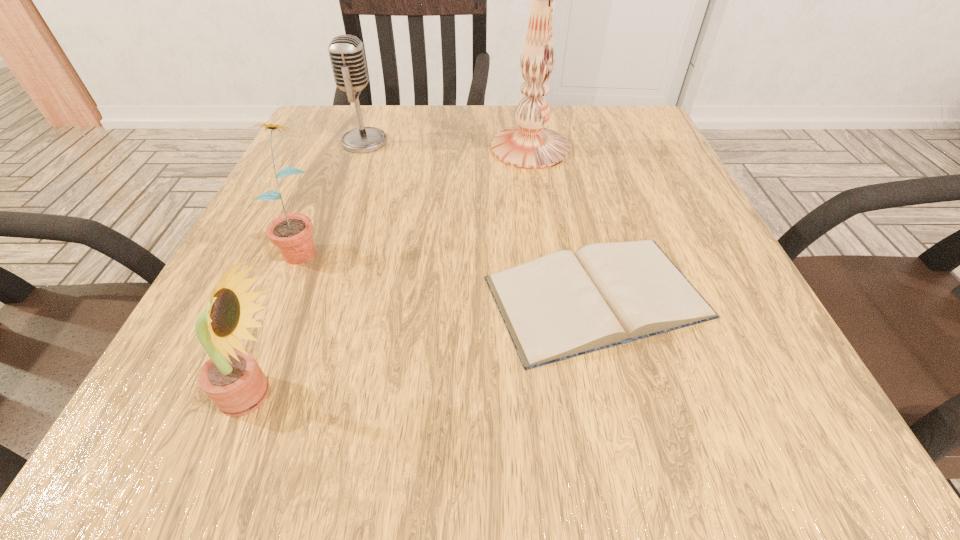
Locate an element on the screen. vacant space that is in between the microphone and the shortest object is located at coordinates (481, 219).

You are a GUI agent. You are given a task and a screenshot of the screen. Output one action in this format:
    pyautogui.click(x=<x>, y=<y>)
    Task: Click on the free spot between the tallest object and the nearer sunflower
    This screenshot has height=540, width=960.
    Given the screenshot: What is the action you would take?
    pyautogui.click(x=393, y=271)

Image resolution: width=960 pixels, height=540 pixels. In order to click on free space between the microphone and the farther sunflower in this screenshot , I will do `click(333, 194)`.

Where is `empty space between the nearer sunflower and the lamp`? empty space between the nearer sunflower and the lamp is located at coordinates (393, 271).

The image size is (960, 540). Find the location of `unoccupied position between the Bible and the nearer sunflower`. unoccupied position between the Bible and the nearer sunflower is located at coordinates (426, 346).

Where is `vacant space that is in between the farther sunflower and the nearer sunflower`? The height and width of the screenshot is (540, 960). vacant space that is in between the farther sunflower and the nearer sunflower is located at coordinates (278, 320).

The height and width of the screenshot is (540, 960). Find the location of `object that is the closest to the nearer sunflower`. object that is the closest to the nearer sunflower is located at coordinates (292, 233).

Where is `object that is the second closest one to the nearer sunflower`? object that is the second closest one to the nearer sunflower is located at coordinates (561, 305).

At what (x,y) coordinates should I click in order to perform the action: click on free space that satisfies the following two spatial constraints: 1. on the front side of the tallest object; 2. on the face of the nearer sunflower. Please return your answer as a coordinate pair (x, y). Image resolution: width=960 pixels, height=540 pixels. Looking at the image, I should click on (566, 394).

The width and height of the screenshot is (960, 540). Identify the location of vacant space that satisfies the following two spatial constraints: 1. on the flower of the shortest object; 2. on the left side of the farther sunflower. click(x=281, y=297).